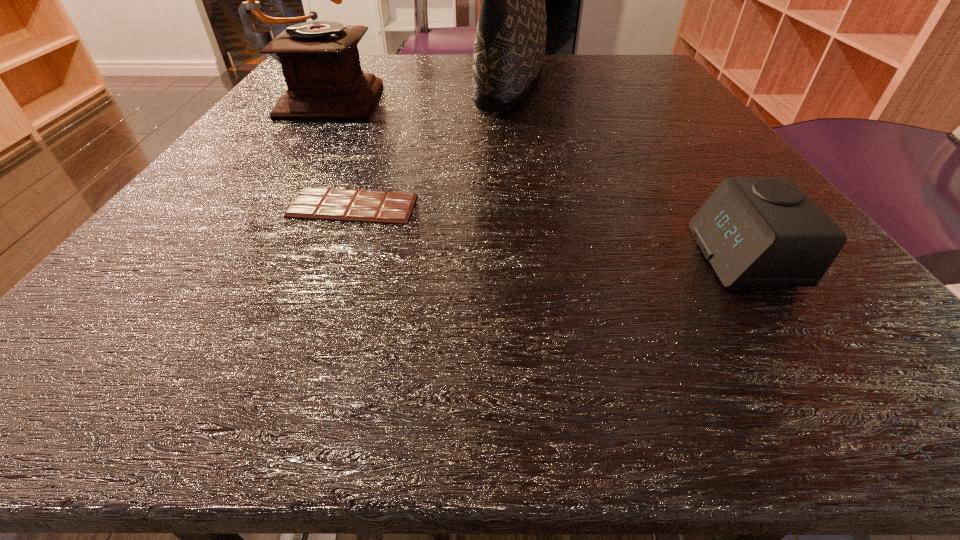
Where is `blank area in the image that satisfies the following two spatial constraints: 1. on the horn of the phonograph record; 2. on the left side of the shortest object`? Image resolution: width=960 pixels, height=540 pixels. blank area in the image that satisfies the following two spatial constraints: 1. on the horn of the phonograph record; 2. on the left side of the shortest object is located at coordinates (252, 206).